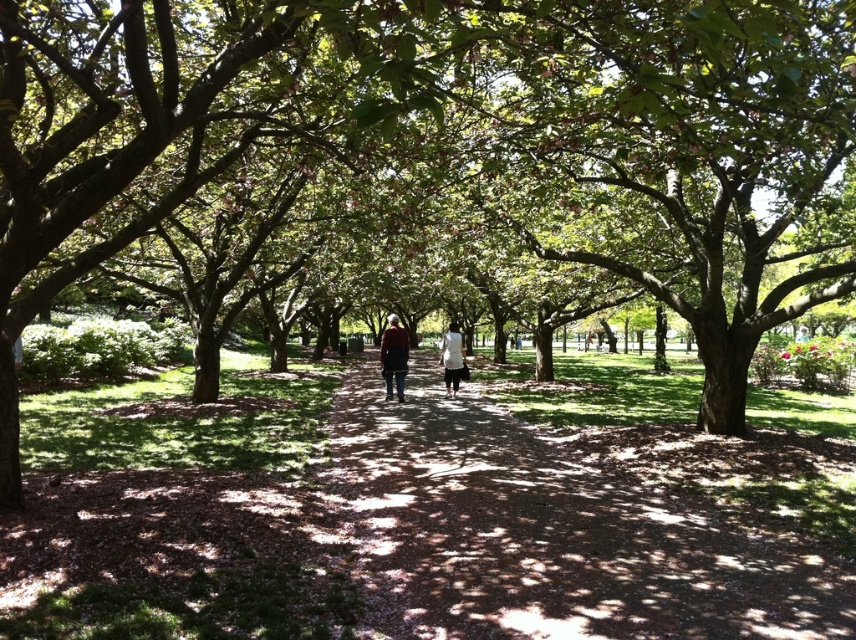
Can you confirm if matte black jacket at center is thinner than dark red sweater at center?

In fact, matte black jacket at center might be wider than dark red sweater at center.

Is matte black jacket at center above dark red sweater at center?

Actually, matte black jacket at center is below dark red sweater at center.

From the picture: Who is more distant from viewer, (444, 346) or (396, 326)?

Point (444, 346)

Locate an element on the screen. The height and width of the screenshot is (640, 856). matte black jacket at center is located at coordinates (394, 356).

Can you confirm if brown dirt path at center is wider than white matte dress at center?

Yes.

What do you see at coordinates (553, 532) in the screenshot?
I see `brown dirt path at center` at bounding box center [553, 532].

Which is behind, point (479, 428) or point (449, 374)?

The point (449, 374) is more distant.

This screenshot has height=640, width=856. Identify the location of brown dirt path at center. (553, 532).

Is matte black jacket at center bigger than white matte dress at center?

Yes, matte black jacket at center is bigger than white matte dress at center.

This screenshot has height=640, width=856. Identify the location of matte black jacket at center. (394, 356).

Where is `matte black jacket at center`? Image resolution: width=856 pixels, height=640 pixels. matte black jacket at center is located at coordinates (394, 356).